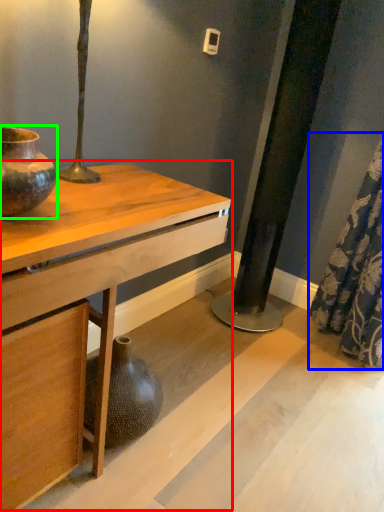
Question: Which object is positioned farthest from table (highlighted by a red box)? Select from shower curtain (highlighted by a blue box) and vase (highlighted by a green box).

Choices:
 (A) shower curtain
 (B) vase

Answer: (A)